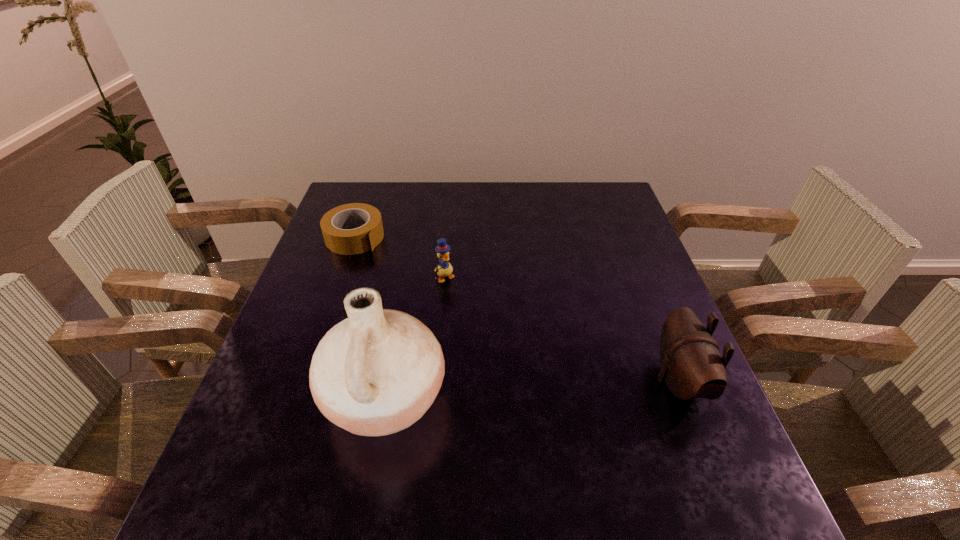
In order to click on vacant area between the third shortest object and the second farthest object in this screenshot , I will do `click(562, 329)`.

Select which object appears as the third closest to the pottery. Please provide its 2D coordinates. Your answer should be formatted as a tuple, i.e. [(x, y)], where the tuple contains the x and y coordinates of a point satisfying the conditions above.

[(691, 365)]

The height and width of the screenshot is (540, 960). Identify the location of the closest object to the pottery. (444, 269).

You are a GUI agent. You are given a task and a screenshot of the screen. Output one action in this format:
    pyautogui.click(x=<x>, y=<y>)
    Task: Click on the vacant point that satisfies the following two spatial constraints: 1. on the front side of the rightmost object; 2. with the flap open on the farthest object
    The image size is (960, 540).
    Given the screenshot: What is the action you would take?
    pyautogui.click(x=305, y=381)